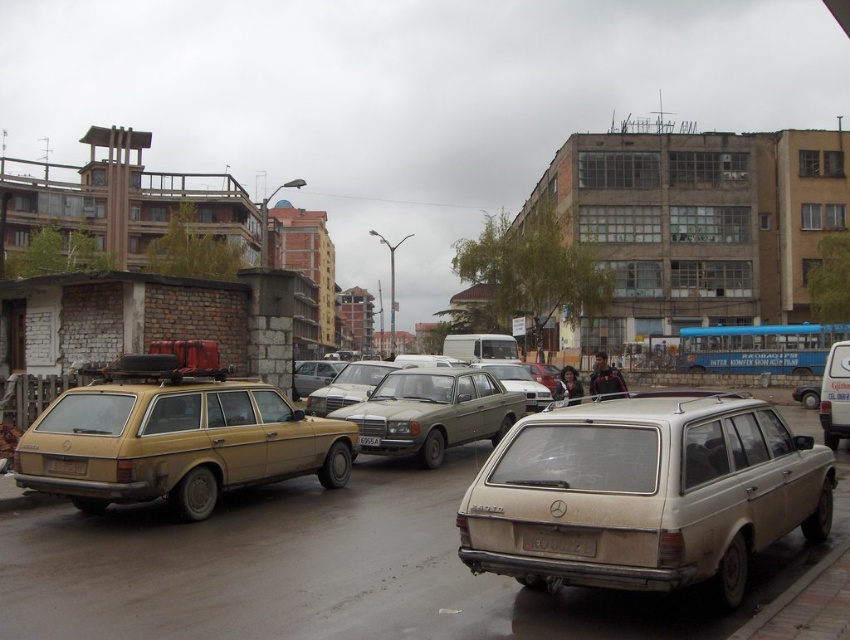
Question: Where is matte gray sedan at center located in relation to yellow matte license plate at center in the image?

Choices:
 (A) below
 (B) above

Answer: (B)

Question: Which point is farther to the camera?

Choices:
 (A) (298, 371)
 (B) (374, 445)
 (C) (786, 481)

Answer: (A)

Question: Considering the real-world distances, which object is closest to the gold matte station wagon at left?

Choices:
 (A) white plastic license plate at center
 (B) matte gray sedan at center
 (C) black plastic license plate at center

Answer: (A)

Question: Based on their relative distances, which object is nearer to the white plastic license plate at center?

Choices:
 (A) dirty beige station wagon at center
 (B) metallic silver sedan at center

Answer: (A)

Question: Is black plastic license plate at center positioned before white plastic license plate at center?

Choices:
 (A) no
 (B) yes

Answer: (B)

Question: Does gold matte station wagon at left have a lesser width compared to silver metallic sedan at center?

Choices:
 (A) yes
 (B) no

Answer: (A)